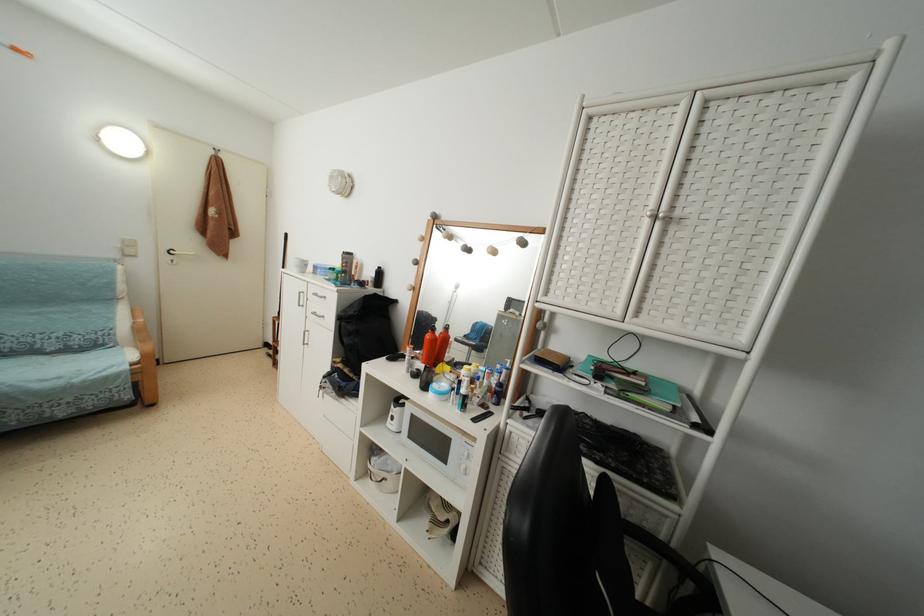
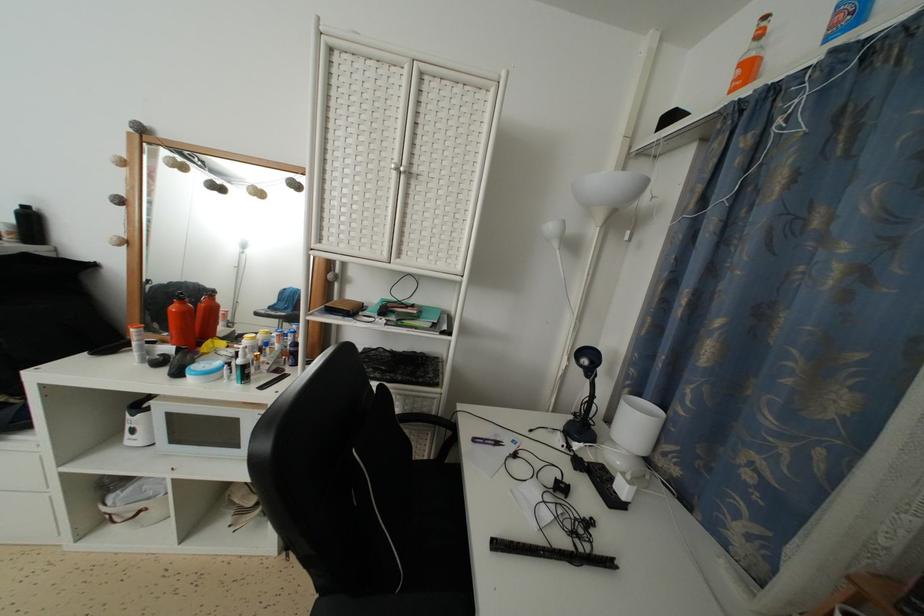
Where in the second image is the point corresponding to [543,331] from the first image?

(334, 282)